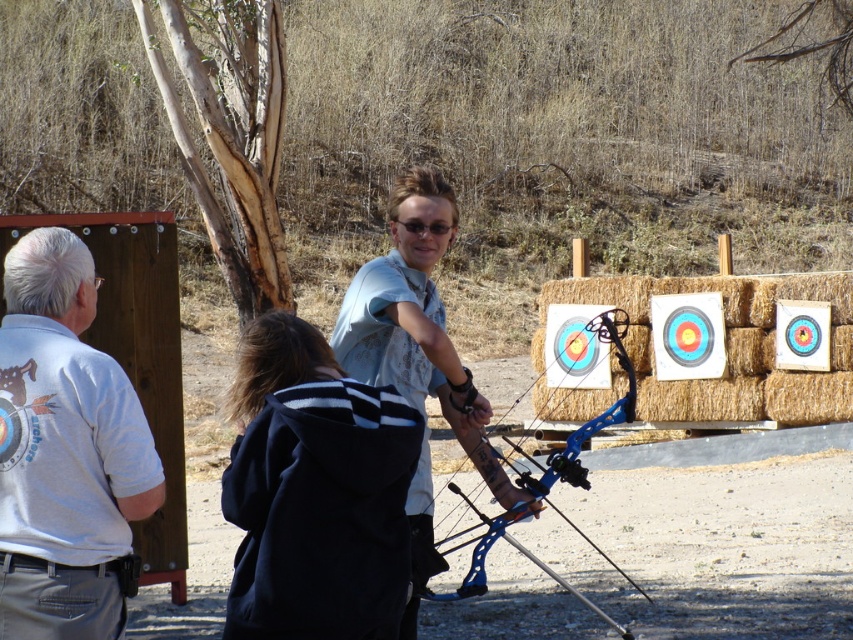
Who is more forward, (12,316) or (424,179)?

Point (12,316)

Does white cotton shirt at left appear under light blue t-shirt at center?

Indeed, white cotton shirt at left is positioned under light blue t-shirt at center.

Measure the distance between point (4, 314) and camera.

4.56 meters

This screenshot has height=640, width=853. Find the location of `white cotton shirt at left`. white cotton shirt at left is located at coordinates (65, 451).

Can you confirm if black fleece jacket at center is shorter than light blue t-shirt at center?

Yes.

The width and height of the screenshot is (853, 640). What are the coordinates of `black fleece jacket at center` in the screenshot? It's located at (315, 492).

The image size is (853, 640). In order to click on black fleece jacket at center in this screenshot , I will do `click(315, 492)`.

Where is `black fleece jacket at center`? The width and height of the screenshot is (853, 640). black fleece jacket at center is located at coordinates (315, 492).

Can you confirm if black fleece jacket at center is wider than blue metallic bow at center?

Incorrect, black fleece jacket at center's width does not surpass blue metallic bow at center's.

Is point (265, 515) positioned behind point (572, 445)?

No.

I want to click on black fleece jacket at center, so click(x=315, y=492).